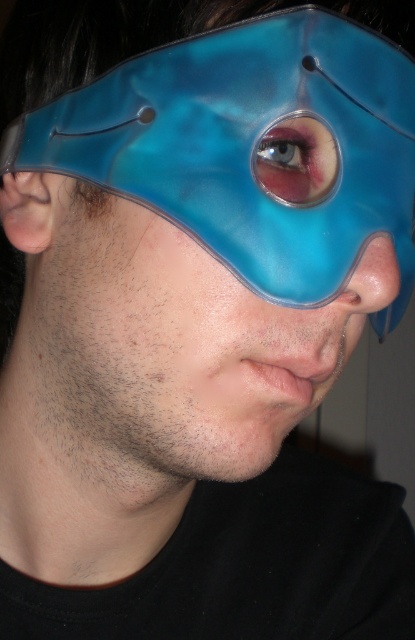
You are a photographer adjusting your camera settings to capture the transparent blue mask at upper right. The camera has a depth of field that can focus sharply on objects within 10 inches. Will the mask be in focus?

The transparent blue mask at upper right is 9.74 inches away from viewer, which is within the camera lens depth of field range of 10 inches. Therefore, the mask will be in focus.

You are a photographer adjusting the focus of your camera. You notice two points in the image at coordinates point (214, 250) and point (302, 161). Which point should you focus on first if you want to ensure the person wearing the mask is clearly visible?

You should focus on point (214, 250) first because it is in front of point (302, 161), meaning it is closer to the camera and thus requires prioritized focus for clarity.

In the scene shown: You are a fashion designer analyzing a mask design. The transparent blue mask at upper right and the purple glossy eye at center are part of the design. Which object takes up more vertical space in the design?

The transparent blue mask at upper right is much taller than the purple glossy eye at center, so it takes up more vertical space in the design.